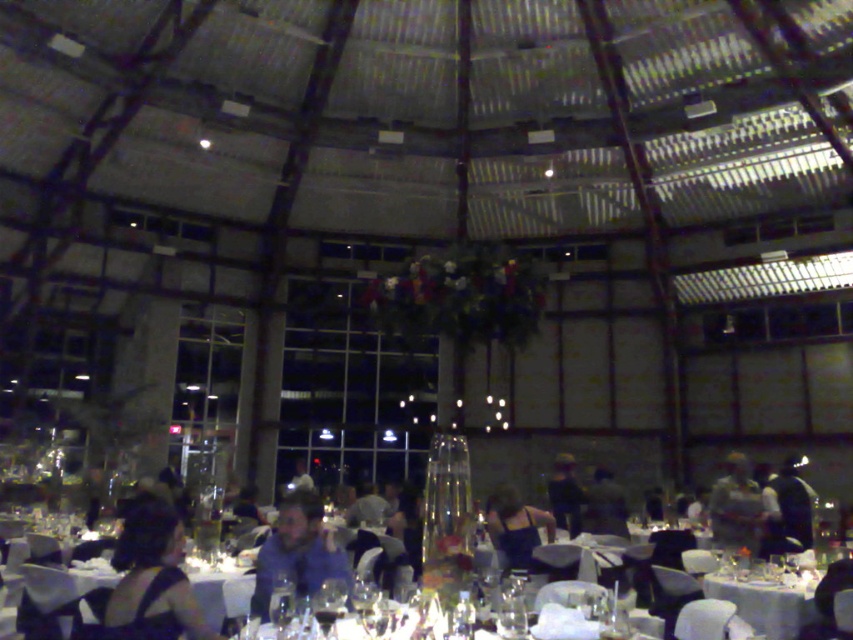
You are a photographer at the event and need to position yourself to capture a shot of the black satin dress at lower left without obstructing the view of the guests seated at the tables. Based on the coordinates provided, can you determine if the dress is positioned in an area that allows for an unobstructed view from the center of the room?

The black satin dress at lower left is located at point (154, 580). Since the tables are arranged in the center and the dress is at the lower left corner, it is likely positioned in an area that allows for an unobstructed view from the center of the room.

You are standing in the banquet hall and want to move from your current position to the point marked as point (x=547, y=529). There is an obstacle at point (x=792, y=477). Will you encounter the obstacle before reaching your destination?

Point (x=792, y=477) is further to the viewer than point (x=547, y=529), so the obstacle at point (x=792, y=477) is closer to you. Therefore, you will encounter the obstacle before reaching the destination point (x=547, y=529).

You are a photographer at the event and need to adjust the lighting to ensure both the black satin dress at lower left and the dark blue shirt at center are well illuminated. Given their sizes, which one might require more focused lighting to avoid being overshadowed?

The black satin dress at lower left has a larger size compared to the dark blue shirt at center, so it might require more focused lighting to ensure its details are visible without being overshadowed.